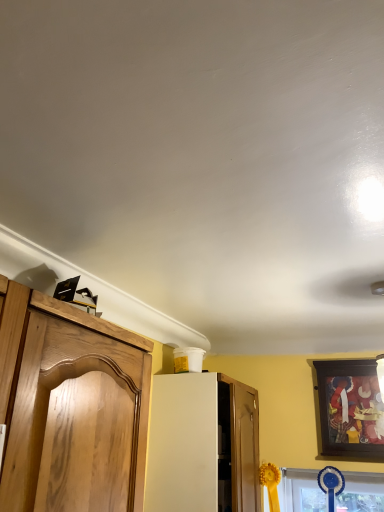
Question: Considering the positions of point (162, 439) and point (324, 361), is point (162, 439) closer or farther from the camera than point (324, 361)?

Choices:
 (A) farther
 (B) closer

Answer: (B)

Question: Looking at their shapes, would you say white matte cabinet at center is wider or thinner than wooden picture frame at upper right?

Choices:
 (A) wide
 (B) thin

Answer: (A)

Question: Relative to wooden picture frame at upper right, is white matte cabinet at center in front or behind?

Choices:
 (A) front
 (B) behind

Answer: (A)

Question: From the image's perspective, relative to white matte cabinet at center, is wooden picture frame at upper right above or below?

Choices:
 (A) above
 (B) below

Answer: (A)

Question: Is wooden picture frame at upper right situated inside white matte cabinet at center or outside?

Choices:
 (A) inside
 (B) outside

Answer: (B)

Question: From a real-world perspective, is wooden picture frame at upper right positioned above or below white matte cabinet at center?

Choices:
 (A) below
 (B) above

Answer: (B)

Question: Would you say wooden picture frame at upper right is to the left or to the right of white matte cabinet at center in the picture?

Choices:
 (A) right
 (B) left

Answer: (A)